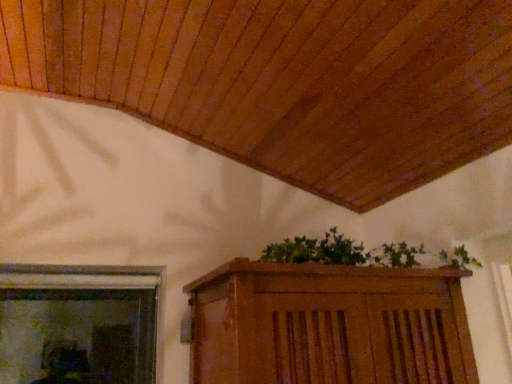
The image size is (512, 384). In order to click on green leafy plant at upper center in this screenshot , I will do `click(359, 253)`.

This screenshot has width=512, height=384. Describe the element at coordinates (359, 253) in the screenshot. I see `green leafy plant at upper center` at that location.

I want to click on green leafy plant at upper center, so click(359, 253).